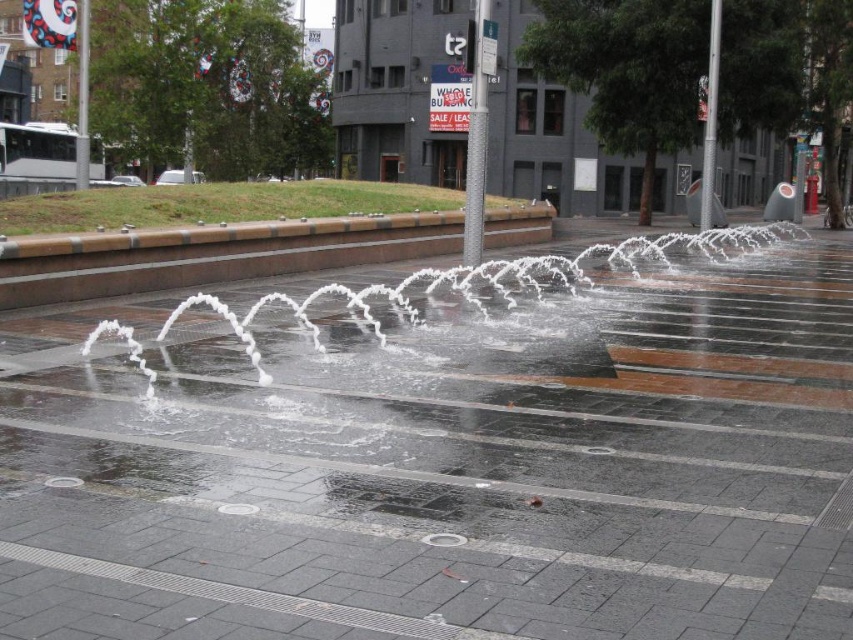
You are a delivery person trying to navigate a small cart through the plaza. The cart requires a path wider than the brown concrete curb at center. Can you use the wet concrete pavement at center for this purpose?

The wet concrete pavement at center has a larger width than the brown concrete curb at center, so yes, the cart can use the wet concrete pavement at center as it provides sufficient width for passage.

You are standing in the plaza and notice the wet concrete pavement at center and the brown concrete curb at center. Which object is located lower in position?

The wet concrete pavement at center is located below the brown concrete curb at center, so it is lower in position.